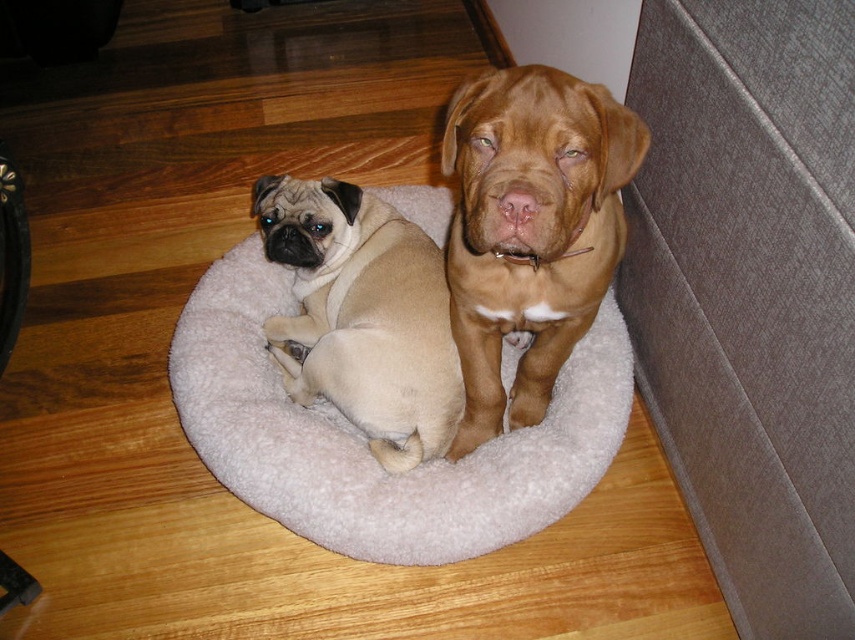
Does brown smooth dog at center appear under beige fur pug at center?

No.

What do you see at coordinates (529, 230) in the screenshot? I see `brown smooth dog at center` at bounding box center [529, 230].

Is point (516, 160) in front of point (329, 237)?

That is True.

At what (x,y) coordinates should I click in order to perform the action: click on brown smooth dog at center. Please return your answer as a coordinate pair (x, y). Looking at the image, I should click on (529, 230).

Describe the element at coordinates (363, 444) in the screenshot. I see `white fluffy dog bed at center` at that location.

Find the location of a particular element. The image size is (855, 640). white fluffy dog bed at center is located at coordinates (363, 444).

What are the coordinates of `white fluffy dog bed at center` in the screenshot? It's located at 363,444.

Between white fluffy dog bed at center and beige fur pug at center, which one appears on the left side from the viewer's perspective?

beige fur pug at center is more to the left.

Can you confirm if white fluffy dog bed at center is thinner than beige fur pug at center?

Incorrect, white fluffy dog bed at center's width is not less than beige fur pug at center's.

Find the location of `white fluffy dog bed at center`. white fluffy dog bed at center is located at coordinates (363, 444).